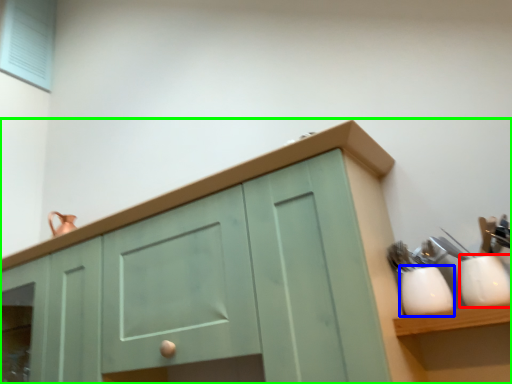
Question: Which object is the farthest from tableware (highlighted by a red box)? Choose among these: tableware (highlighted by a blue box) or cabinetry (highlighted by a green box).

Choices:
 (A) tableware
 (B) cabinetry

Answer: (B)